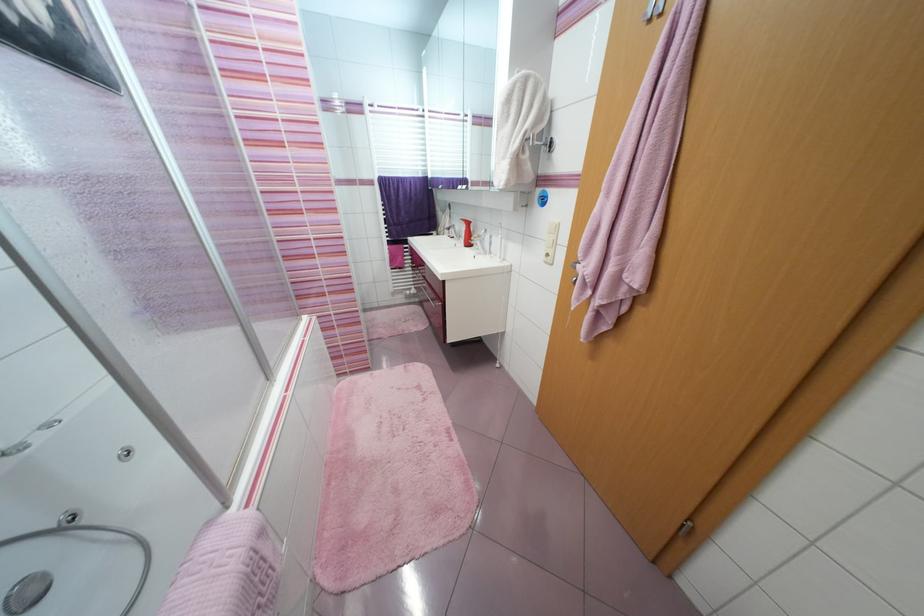
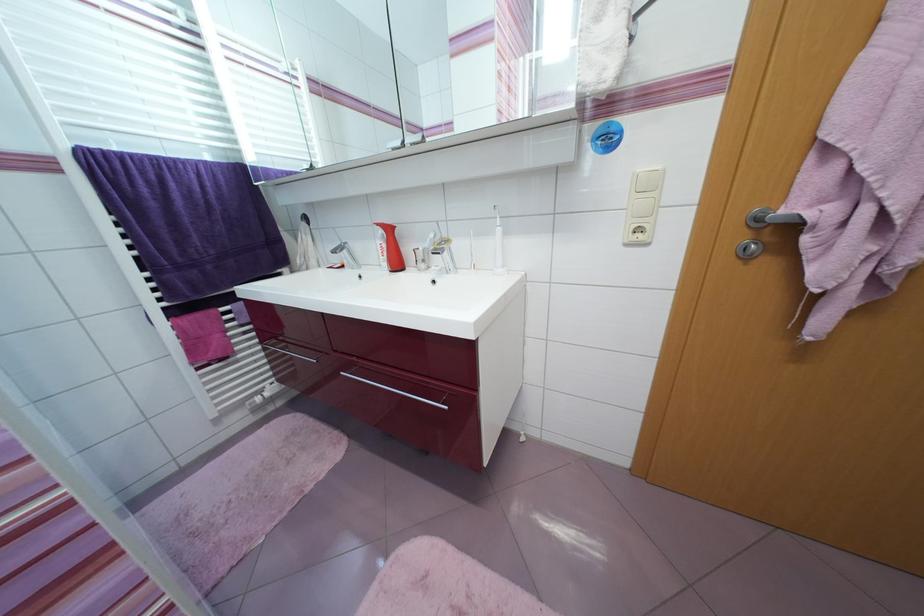
Find the pixel in the second image that matches point 473,225 in the first image.

(394, 231)